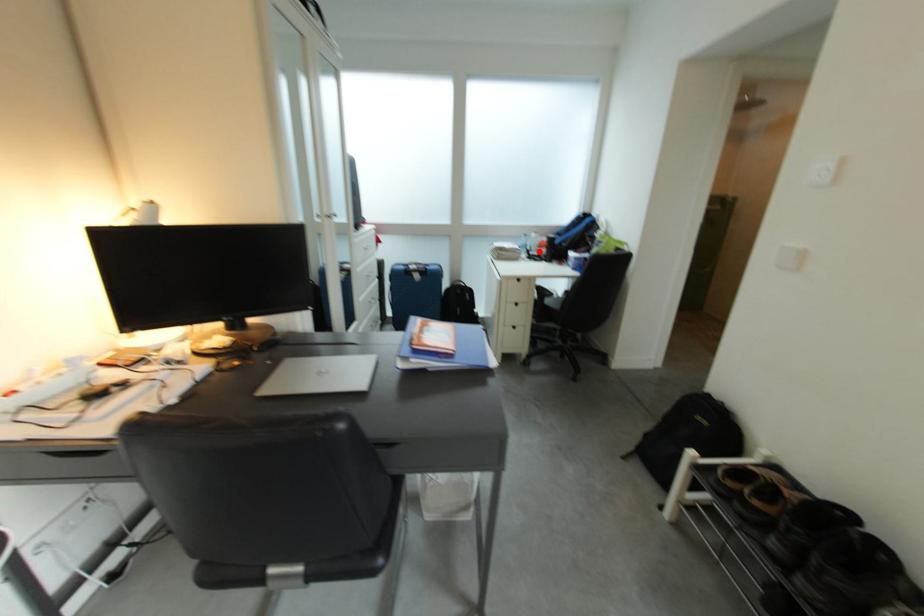
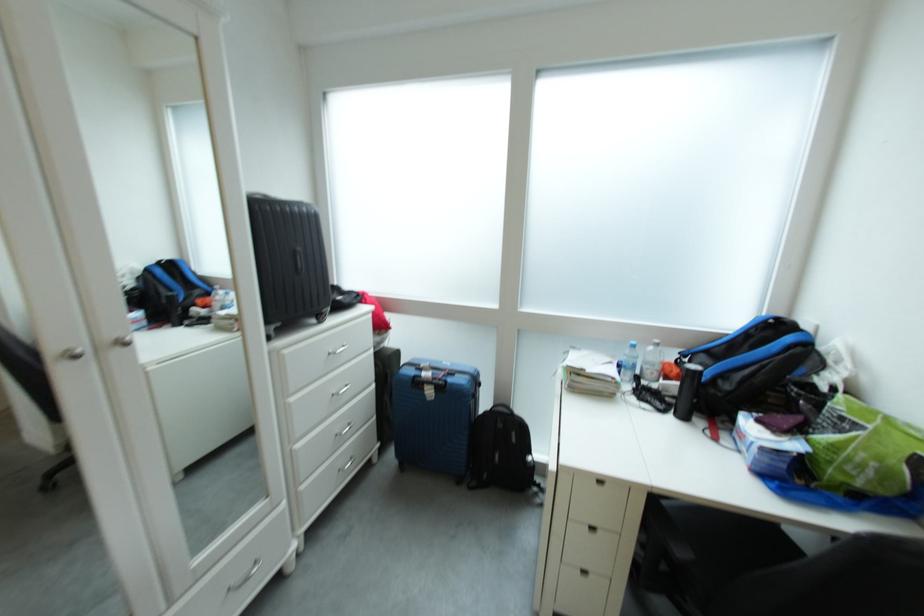
Question: I am providing you with two images of the same scene from different viewpoints. Given a red point in image1, look at the same physical point in image2. Is it:

Choices:
 (A) Closer to the viewpoint
 (B) Farther from the viewpoint

Answer: (B)